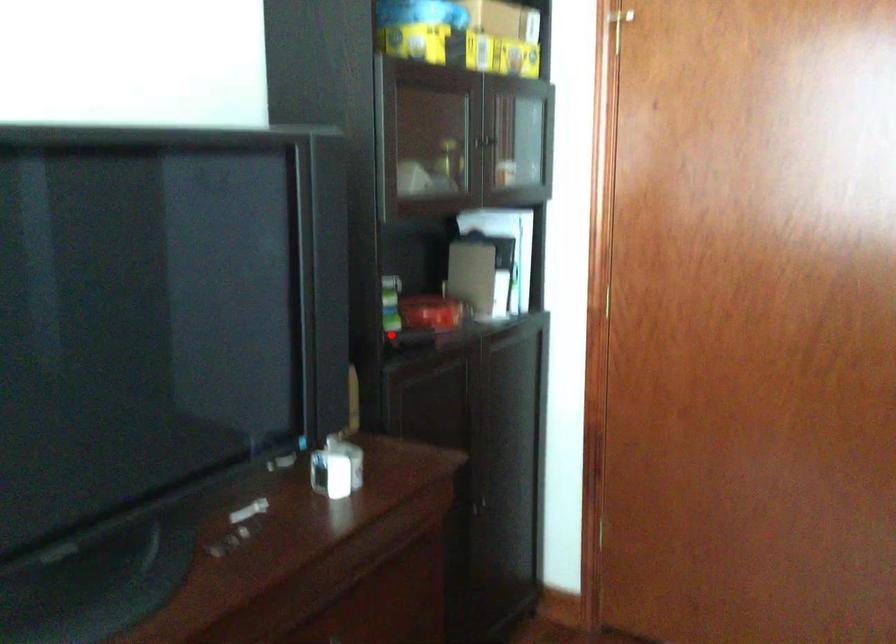
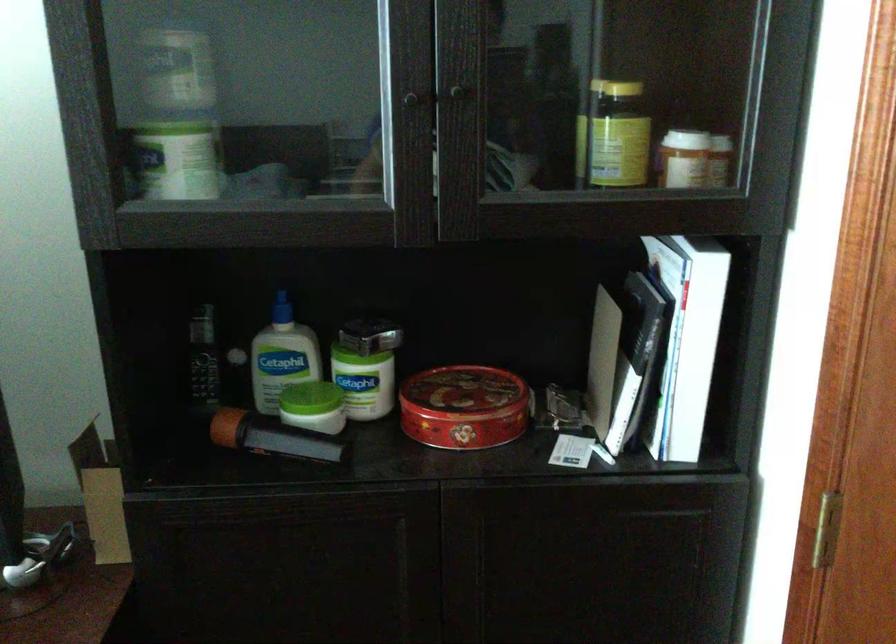
Question: I am providing you with two images of the same scene from different viewpoints. Image1 has a red point marked. In image2, the corresponding 3D location appears at what relative position? Reply with the corresponding letter.

Choices:
 (A) Closer
 (B) Farther

Answer: (A)